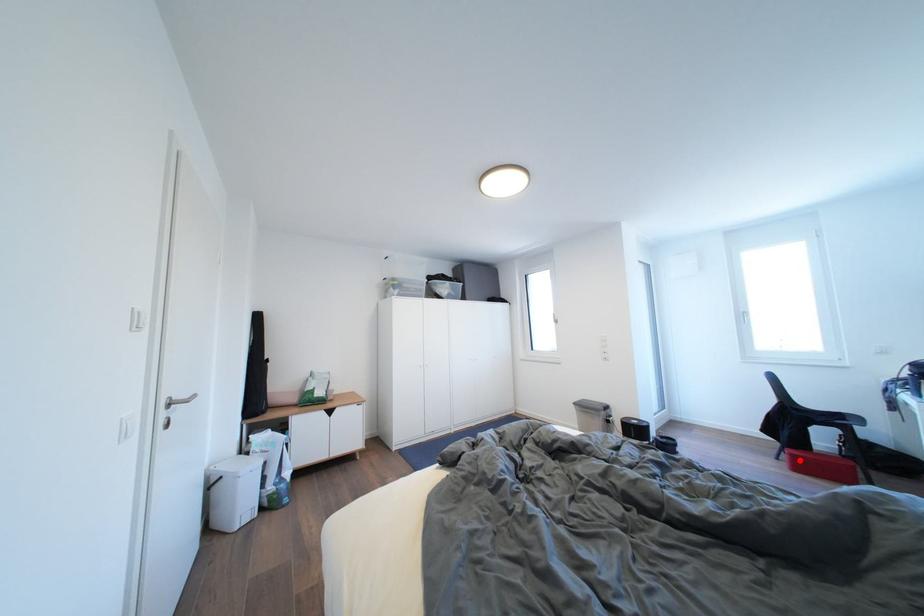
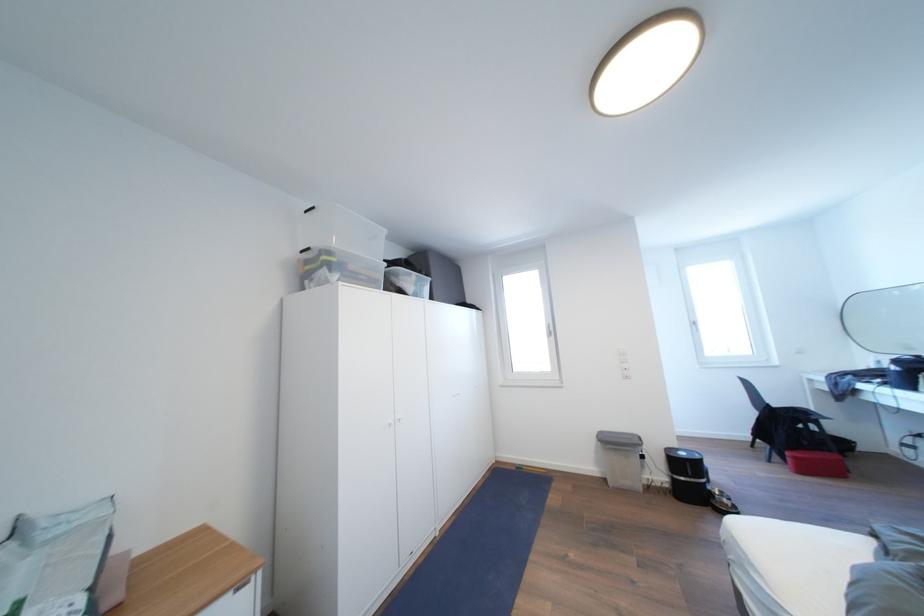
Question: A red point is marked in image1. In image2, is the corresponding 3D point closer to the camera or farther? Reply with the corresponding letter.

Choices:
 (A) The corresponding 3D point is closer.
 (B) The corresponding 3D point is farther.

Answer: (A)